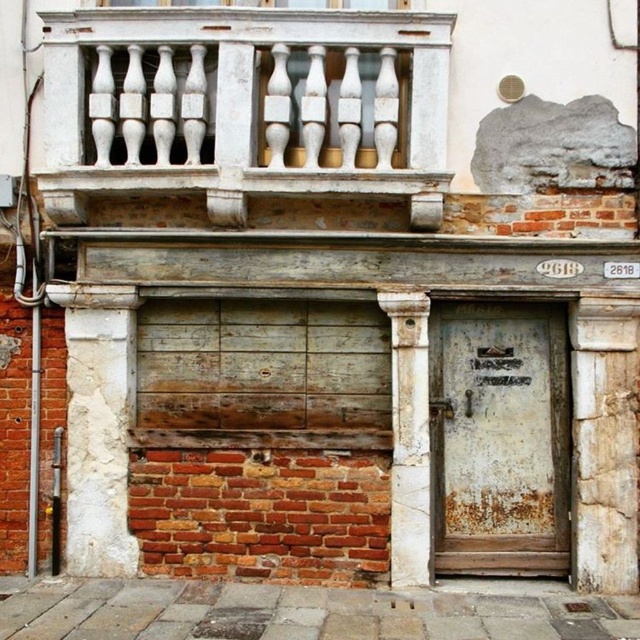
Question: Estimate the real-world distances between objects in this image. Which object is farther from the white rough stone pillar at left?

Choices:
 (A) white painted wood at upper center
 (B) white marble column at center
 (C) rusty wood door at center
 (D) rusty metal door at lower right

Answer: (D)

Question: Which of the following is the farthest from the observer?

Choices:
 (A) (480, 541)
 (B) (444, 499)

Answer: (B)

Question: Is white painted wood at upper center to the right of white marble column at center from the viewer's perspective?

Choices:
 (A) yes
 (B) no

Answer: (B)

Question: Does white rough stone pillar at left have a greater width compared to rusty metal door at lower right?

Choices:
 (A) no
 (B) yes

Answer: (A)

Question: Which object is farther from the camera taking this photo?

Choices:
 (A) white painted wood at upper center
 (B) rusty metal door at lower right
 (C) white marble column at center

Answer: (B)

Question: Is rusty wood door at center closer to camera compared to rusty metal door at lower right?

Choices:
 (A) no
 (B) yes

Answer: (B)